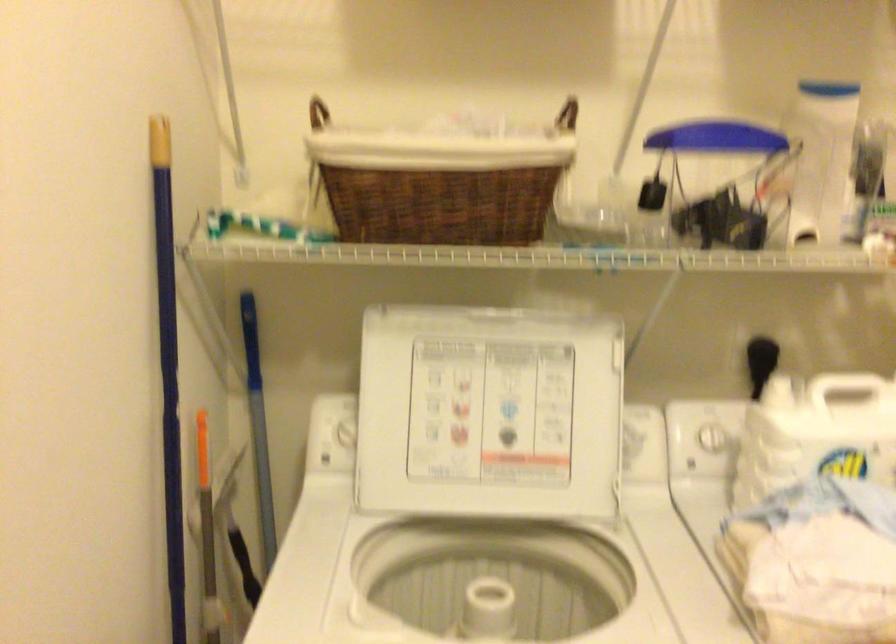
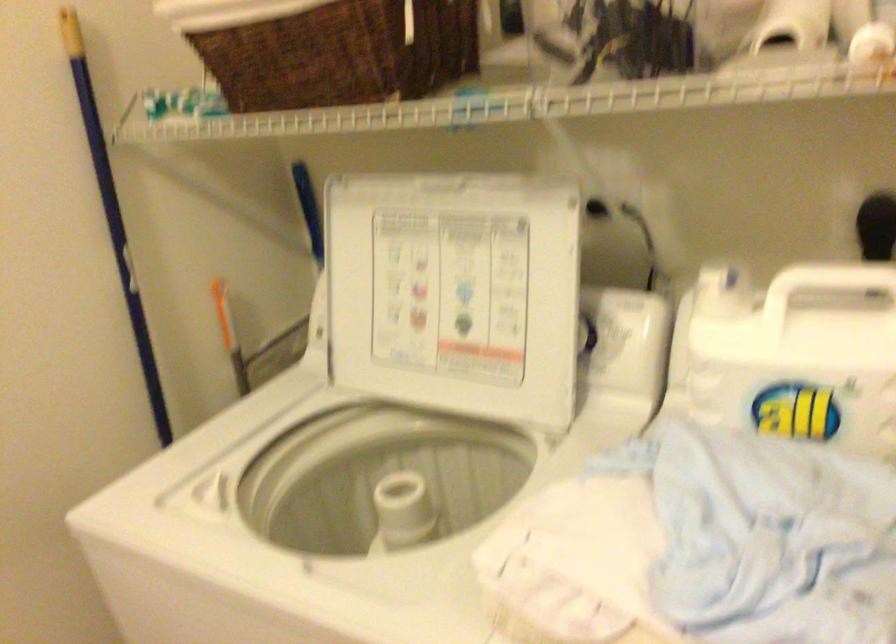
In the second image, find the point that corresponds to point (497, 412) in the first image.

(454, 292)